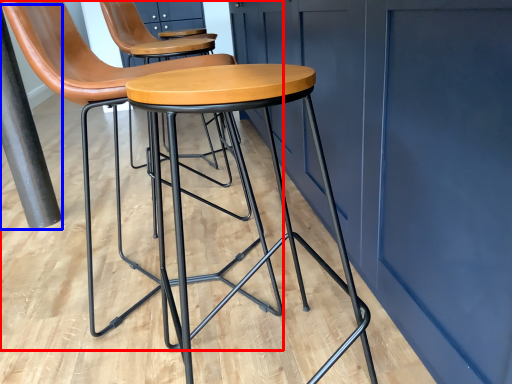
Question: Which point is further to the camera, chair (highlighted by a red box) or pole (highlighted by a blue box)?

Choices:
 (A) chair
 (B) pole

Answer: (B)